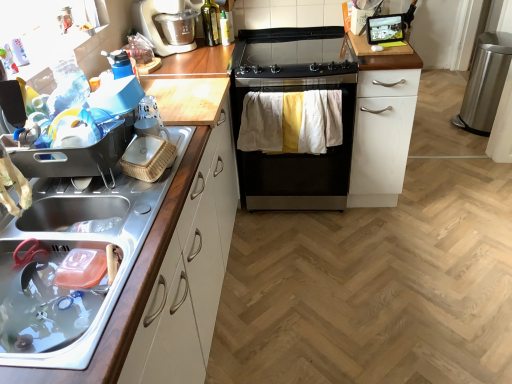
Locate an element on the screen. Image resolution: width=512 pixels, height=384 pixels. spots to the right of white matte cabinet at center-right, the 2th cabinetry from the left is located at coordinates (438, 187).